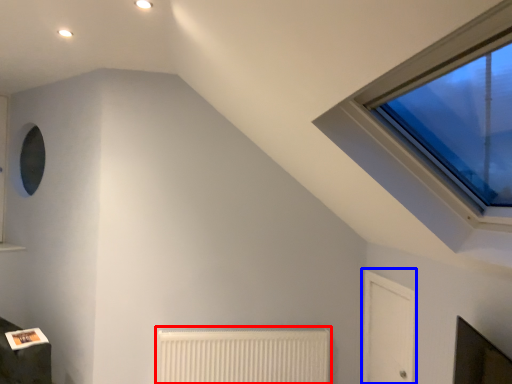
Question: Among these objects, which one is nearest to the camera, radiator (highlighted by a red box) or glass door (highlighted by a blue box)?

Choices:
 (A) radiator
 (B) glass door

Answer: (B)